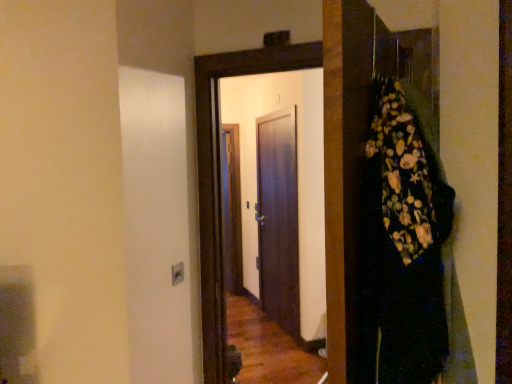
Question: Could you tell me if dark wood door at center, the first door in the back-to-front sequence, is facing floral-patterned fabric at right?

Choices:
 (A) yes
 (B) no

Answer: (B)

Question: Considering the relative sizes of dark wood door at center, which is counted as the 2th door, starting from the front, and floral-patterned fabric at right in the image provided, is dark wood door at center, which is counted as the 2th door, starting from the front, bigger than floral-patterned fabric at right?

Choices:
 (A) no
 (B) yes

Answer: (B)

Question: Is dark wood door at center, the first door in the back-to-front sequence, facing away from floral-patterned fabric at right?

Choices:
 (A) yes
 (B) no

Answer: (B)

Question: Can you confirm if dark wood door at center, the first door in the back-to-front sequence, is positioned to the left of floral-patterned fabric at right?

Choices:
 (A) no
 (B) yes

Answer: (B)

Question: Does dark wood door at center, which is counted as the 2th door, starting from the front, have a greater height compared to floral-patterned fabric at right?

Choices:
 (A) no
 (B) yes

Answer: (B)

Question: Visually, is dark wood door at center, the first door viewed from the front, positioned to the left or to the right of floral-patterned fabric at right?

Choices:
 (A) right
 (B) left

Answer: (B)

Question: From a real-world perspective, is dark wood door at center, acting as the second door starting from the back, above or below floral-patterned fabric at right?

Choices:
 (A) below
 (B) above

Answer: (A)

Question: Is dark wood door at center, acting as the second door starting from the back, spatially inside floral-patterned fabric at right, or outside of it?

Choices:
 (A) outside
 (B) inside

Answer: (A)

Question: Considering the positions of dark wood door at center, acting as the second door starting from the back, and floral-patterned fabric at right in the image, is dark wood door at center, acting as the second door starting from the back, wider or thinner than floral-patterned fabric at right?

Choices:
 (A) wide
 (B) thin

Answer: (B)

Question: In the image, is floral-patterned fabric at right positioned in front of or behind dark wood door at center, the first door in the back-to-front sequence?

Choices:
 (A) front
 (B) behind

Answer: (A)

Question: In terms of height, does floral-patterned fabric at right look taller or shorter compared to dark wood door at center, which is counted as the 2th door, starting from the front?

Choices:
 (A) tall
 (B) short

Answer: (B)

Question: Is floral-patterned fabric at right wider or thinner than dark wood door at center, the first door in the back-to-front sequence?

Choices:
 (A) thin
 (B) wide

Answer: (B)

Question: From the image's perspective, is floral-patterned fabric at right located above or below dark wood door at center, the first door in the back-to-front sequence?

Choices:
 (A) below
 (B) above

Answer: (B)

Question: Is dark wood door at center, the first door viewed from the front, inside or outside of dark wood door at center, the first door in the back-to-front sequence?

Choices:
 (A) outside
 (B) inside

Answer: (A)

Question: Looking at their shapes, would you say dark wood door at center, the first door viewed from the front, is wider or thinner than dark wood door at center, which is counted as the 2th door, starting from the front?

Choices:
 (A) wide
 (B) thin

Answer: (A)